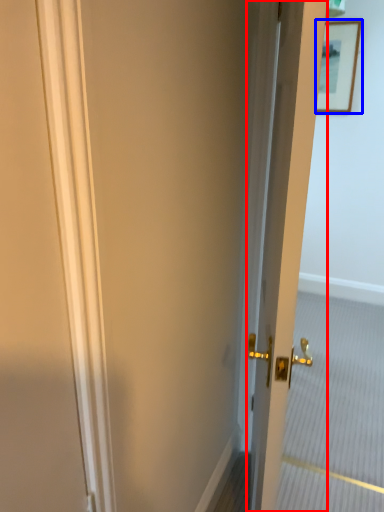
Question: Which of the following is the farthest to the observer, door (highlighted by a red box) or picture frame (highlighted by a blue box)?

Choices:
 (A) door
 (B) picture frame

Answer: (B)